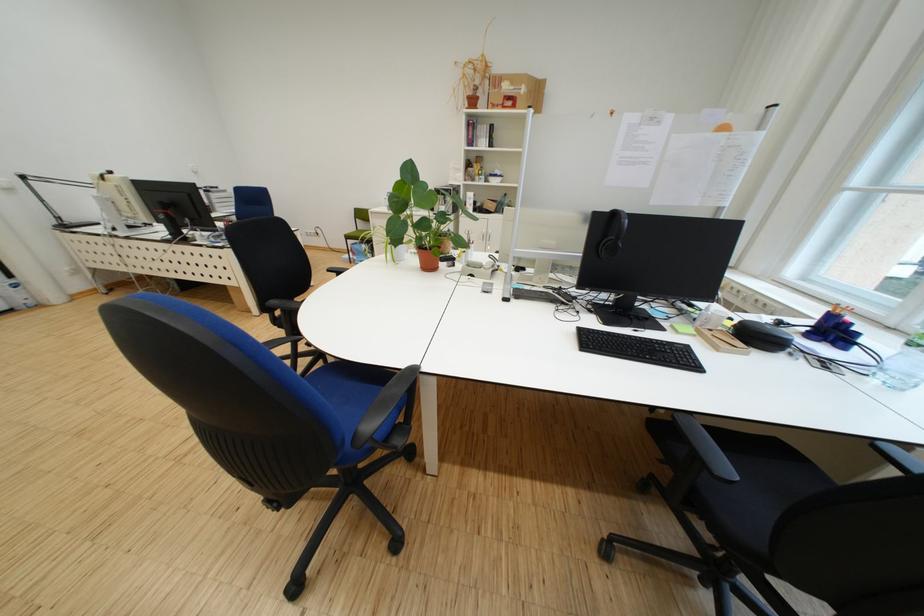
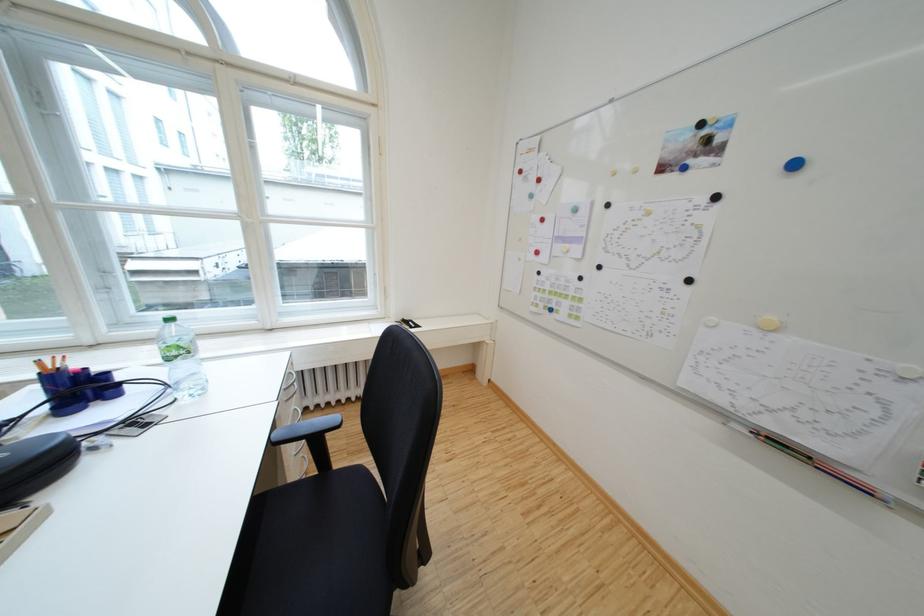
Where in the second image is the point corresponding to (x=845, y=334) from the first image?

(94, 391)